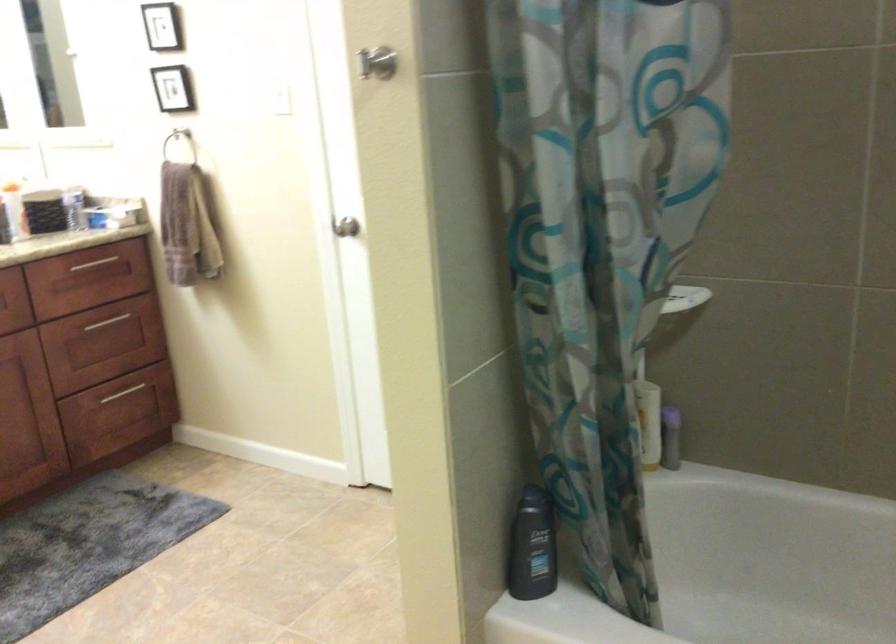
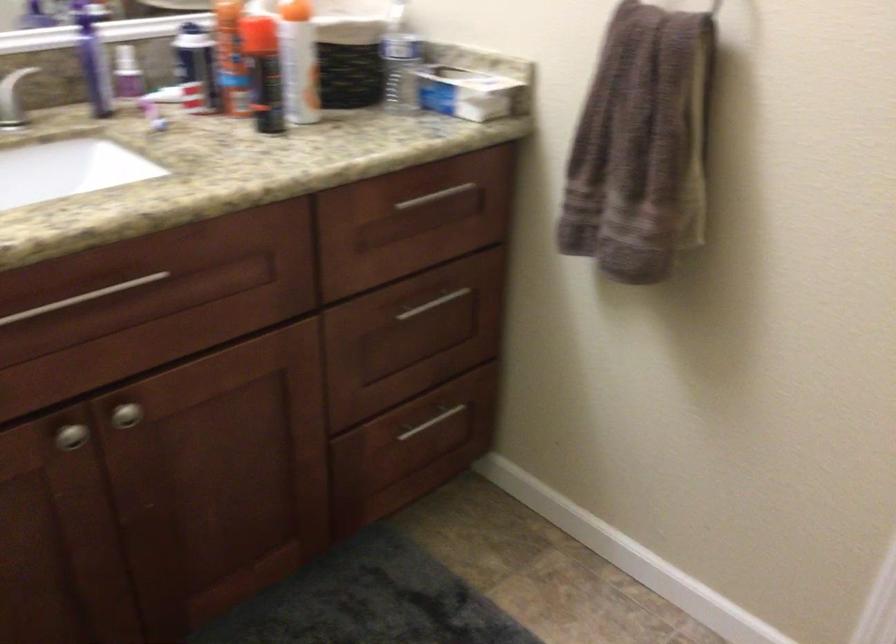
Locate, in the second image, the point that corresponds to pixel 116 319 in the first image.

(434, 304)